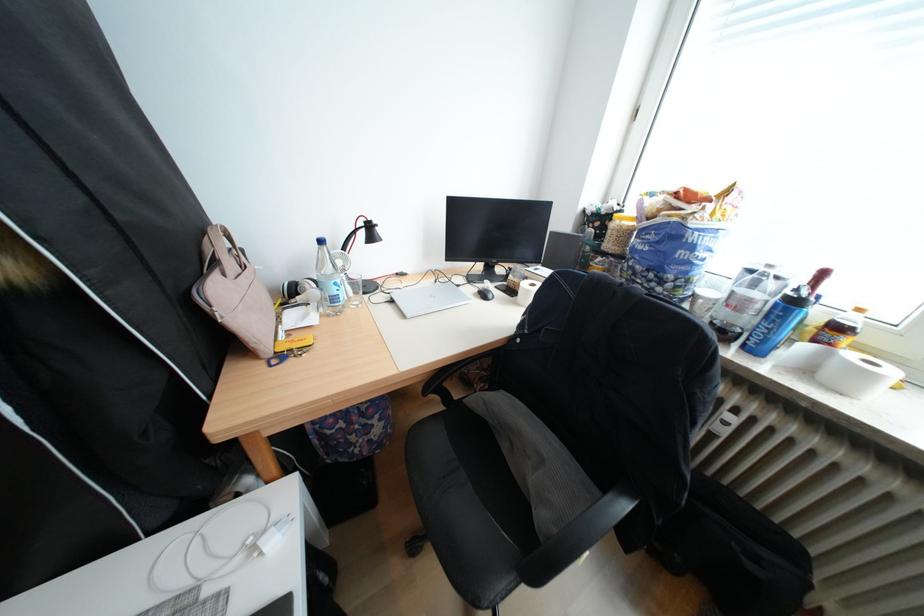
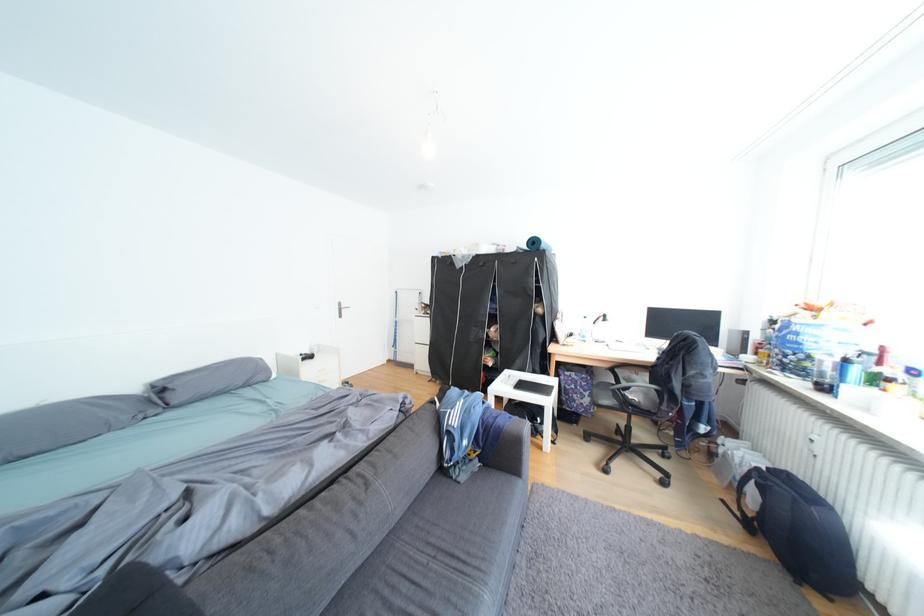
The point at (227,264) is marked in the first image. Where is the corresponding point in the second image?

(570, 318)